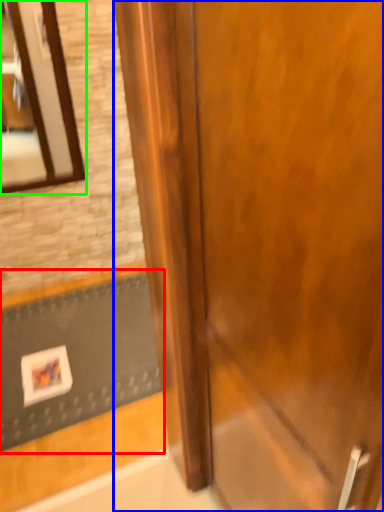
Question: Based on their relative distances, which object is nearer to doormat (highlighted by a red box)? Choose from door (highlighted by a blue box) and mirror (highlighted by a green box).

Choices:
 (A) door
 (B) mirror

Answer: (B)